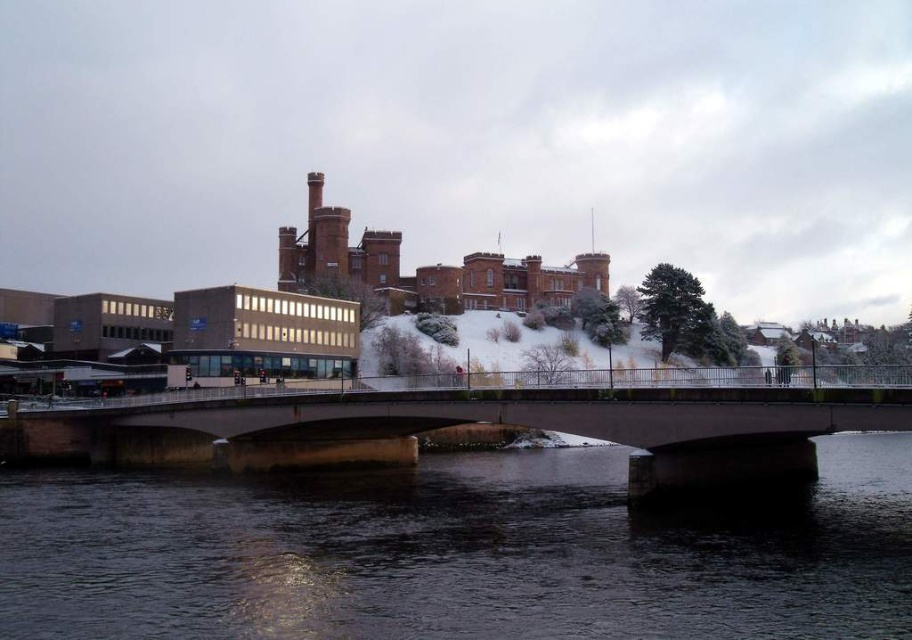
You are standing on the bridge and want to know where the black water at center is positioned relative to your viewpoint. Can you determine its coordinates?

The black water at center is located at point coordinates of 0.867 on the x axis and 0.500 on the y axis.

You are a photographer planning to capture the reflection of the concrete bridge at center in the black water at center. Based on their positions, do you think the reflection will be visible on the water surface?

The black water at center is to the right of concrete bridge at center, so the reflection of the concrete bridge at center would appear on the water surface to its right side. Since the bridge is over the water, its reflection should be visible as long as the water is calm and undisturbed.